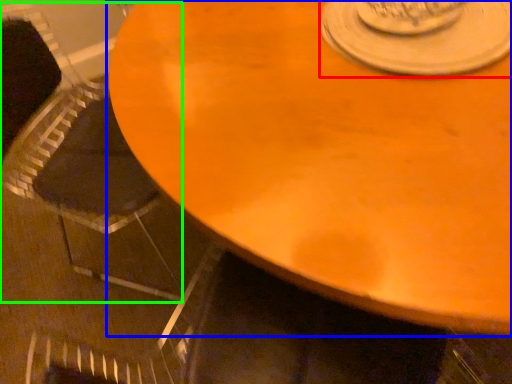
Question: Based on their relative distances, which object is farther from saucer (highlighted by a red box)? Choose from table (highlighted by a blue box) and armchair (highlighted by a green box).

Choices:
 (A) table
 (B) armchair

Answer: (B)